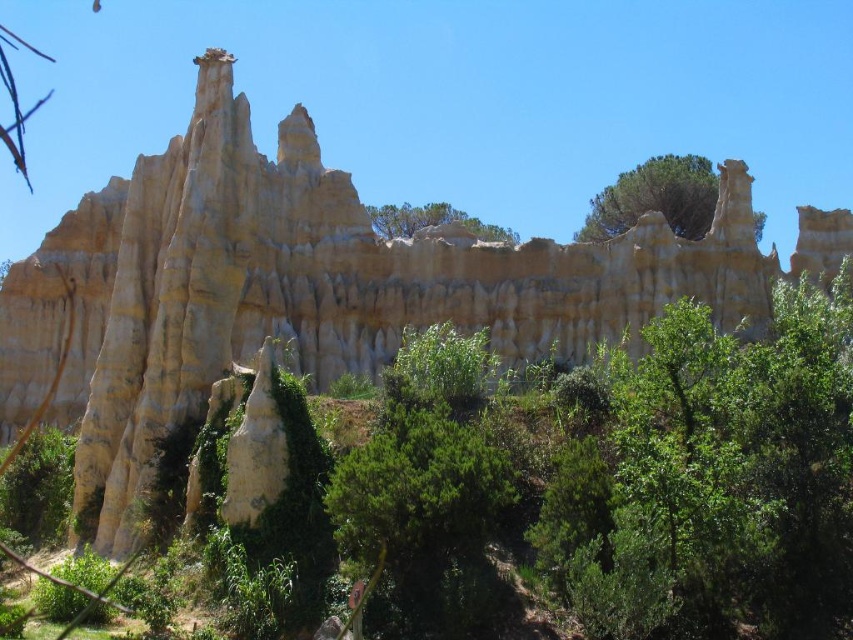
You are a photographer standing in front of the rock formations and want to capture both the point at coordinates point [683,182] and point [410,209] in your photo. Which point will appear larger in the photo?

Point [683,182] is closer to the camera than point [410,209], so it will appear larger in the photo.

You are standing at the base of the rock formations and notice the green leafy tree at upper center. According to the coordinates provided, is the tree positioned more to the left or right side of the image?

The green leafy tree at upper center is located at point 0.309 on the x and 0.769 on the y. Since the x coordinate is less than 0.5, the tree is positioned more to the left side of the image.